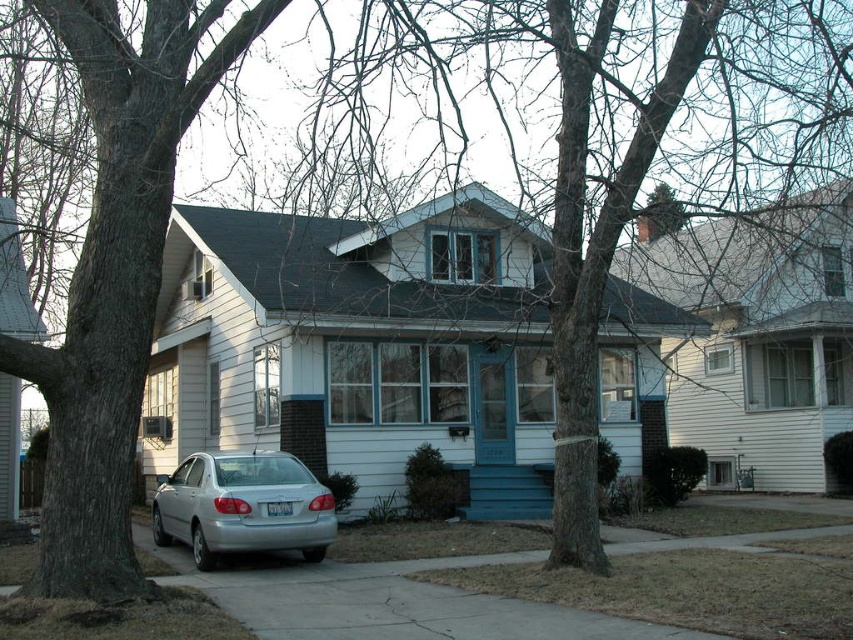
Question: Is smooth gray bark at left behind smooth bark tree at center?

Choices:
 (A) no
 (B) yes

Answer: (A)

Question: Does smooth gray bark at left have a lesser width compared to smooth bark tree at center?

Choices:
 (A) yes
 (B) no

Answer: (A)

Question: Considering the relative positions of smooth gray bark at left and smooth bark tree at center in the image provided, where is smooth gray bark at left located with respect to smooth bark tree at center?

Choices:
 (A) above
 (B) below

Answer: (B)

Question: Among these points, which one is nearest to the camera?

Choices:
 (A) tap(93, 276)
 (B) tap(564, 497)
 (C) tap(315, 509)

Answer: (A)

Question: Which of these objects is positioned farthest from the smooth bark tree at center?

Choices:
 (A) smooth gray bark at left
 (B) silver metallic sedan at center

Answer: (A)

Question: Which object is the farthest from the smooth gray bark at left?

Choices:
 (A) silver metallic sedan at center
 (B) smooth bark tree at center

Answer: (B)